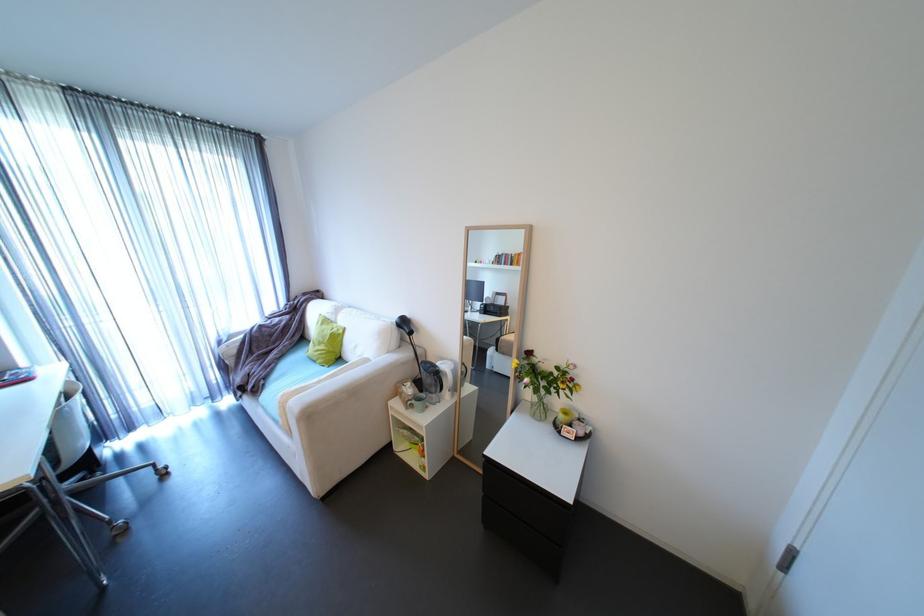
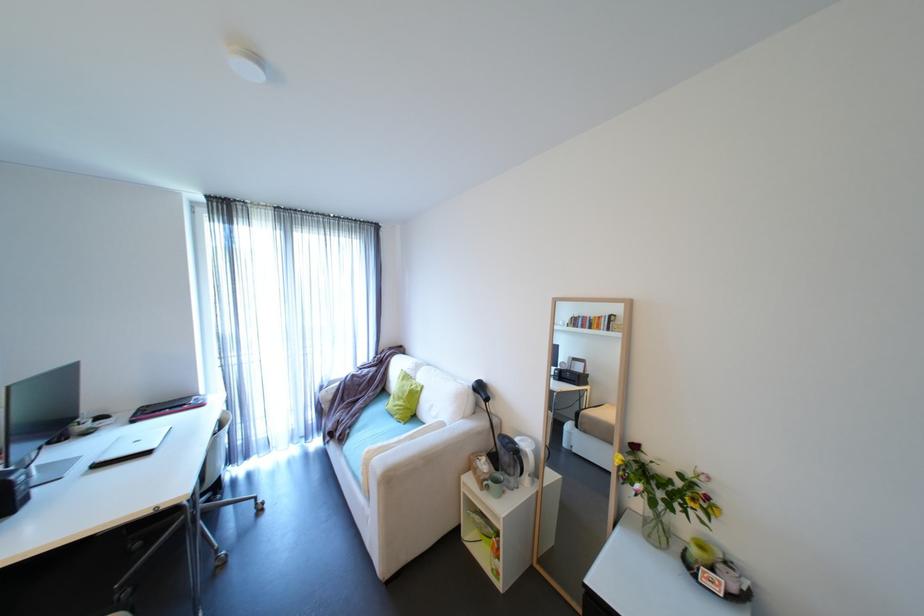
In the second image, find the point that corresponds to pixel 261 390 in the first image.

(347, 438)